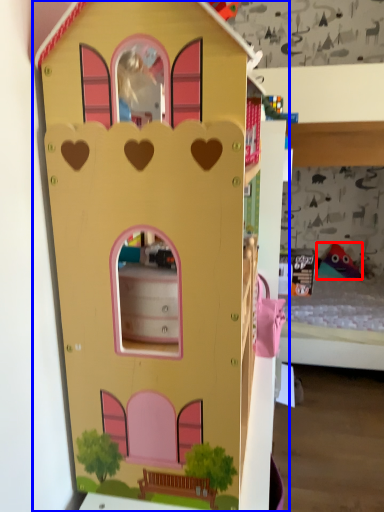
Question: Which object appears farthest to the camera in this image, toy (highlighted by a red box) or toy (highlighted by a blue box)?

Choices:
 (A) toy
 (B) toy

Answer: (A)